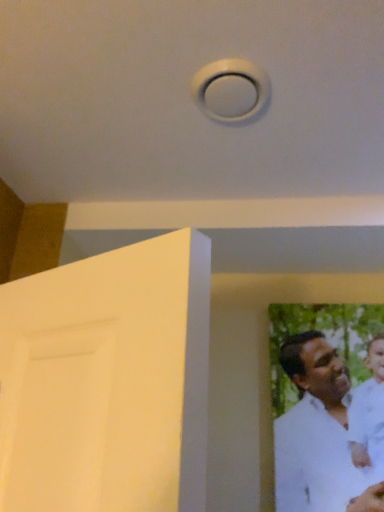
The height and width of the screenshot is (512, 384). Identify the location of white matte shirt at right. (319, 435).

What is the approximate height of white matte shirt at right?

The height of white matte shirt at right is 25.77 inches.

Describe the element at coordinates (319, 435) in the screenshot. I see `white matte shirt at right` at that location.

You are a GUI agent. You are given a task and a screenshot of the screen. Output one action in this format:
    pyautogui.click(x=<x>, y=<y>)
    Task: Click on the white matte shirt at right
    
    Given the screenshot: What is the action you would take?
    pyautogui.click(x=319, y=435)